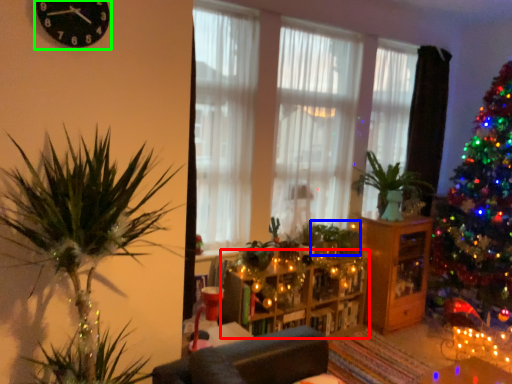
Question: Considering the real-world distances, which object is farthest from entertainment center (highlighted by a red box)? plant (highlighted by a blue box) or clock (highlighted by a green box)?

Choices:
 (A) plant
 (B) clock

Answer: (B)